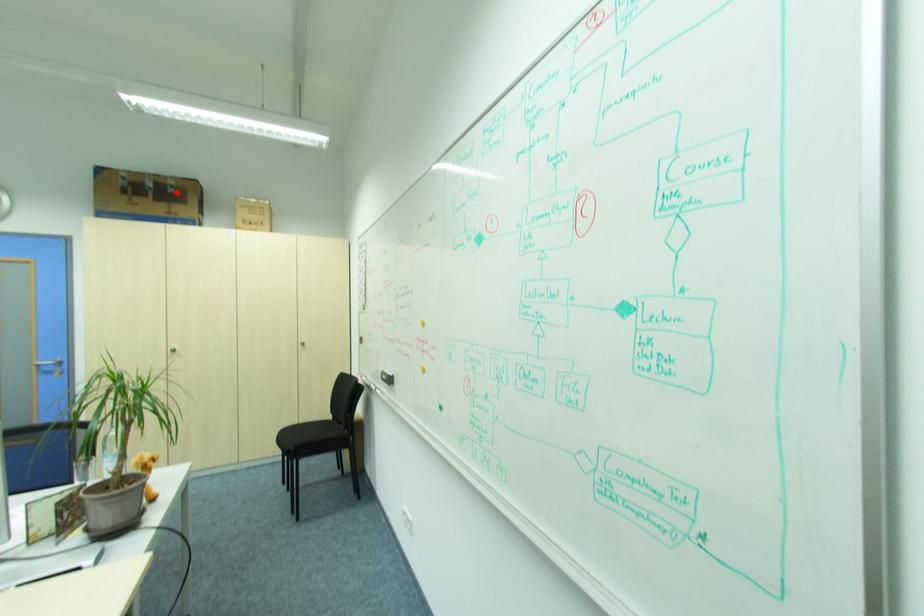
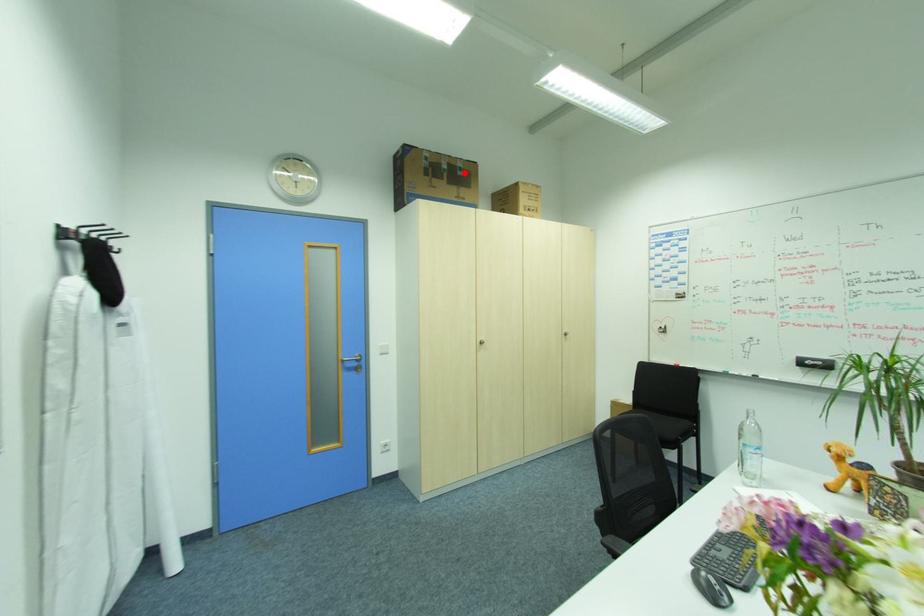
I am providing you with two images of the same scene from different viewpoints. A red point is marked on the first image and another point is marked on the second image. Does the point marked in image1 correspond to the same location as the one in image2?

Yes